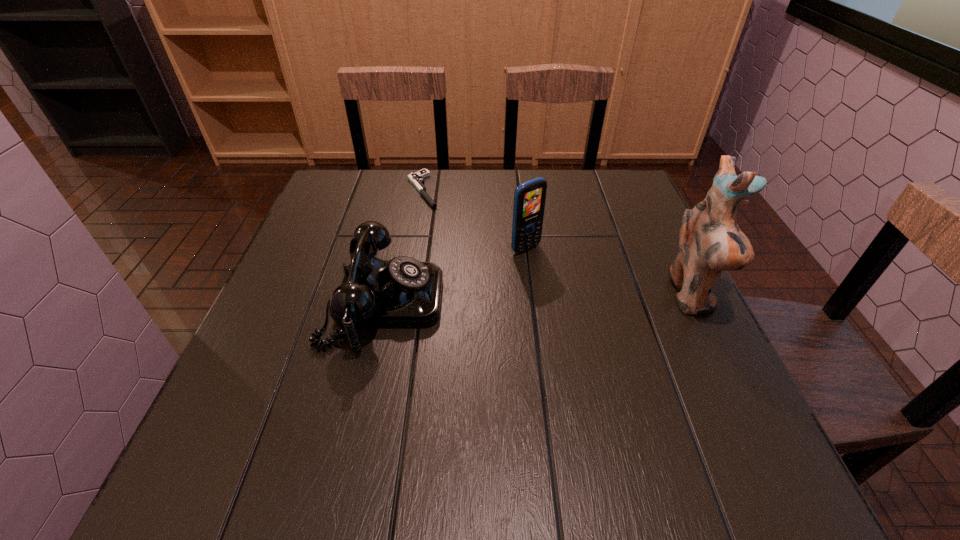
What are the coordinates of `the second shortest object` in the screenshot? It's located at (403, 292).

Locate an element on the screen. The width and height of the screenshot is (960, 540). figurine is located at coordinates (710, 241).

Locate an element on the screen. the rightmost object is located at coordinates (710, 241).

Locate an element on the screen. This screenshot has height=540, width=960. cellular telephone is located at coordinates (529, 198).

Identify the location of the third shortest object. (529, 198).

You are a GUI agent. You are given a task and a screenshot of the screen. Output one action in this format:
    pyautogui.click(x=<x>, y=<y>)
    Task: Click on the farthest object
    The width and height of the screenshot is (960, 540).
    Given the screenshot: What is the action you would take?
    pyautogui.click(x=417, y=179)

Image resolution: width=960 pixels, height=540 pixels. In order to click on the shortest object in this screenshot , I will do `click(417, 179)`.

At what (x,y) coordinates should I click in order to perform the action: click on vacant position located 0.370m on the dial of the telephone. Please return your answer as a coordinate pair (x, y). Looking at the image, I should click on (615, 302).

Identify the location of vacant space situated 0.050m on the screen of the cellular telephone. (549, 267).

Where is `vacant space located on the screen of the cellular telephone`? Image resolution: width=960 pixels, height=540 pixels. vacant space located on the screen of the cellular telephone is located at coordinates (554, 272).